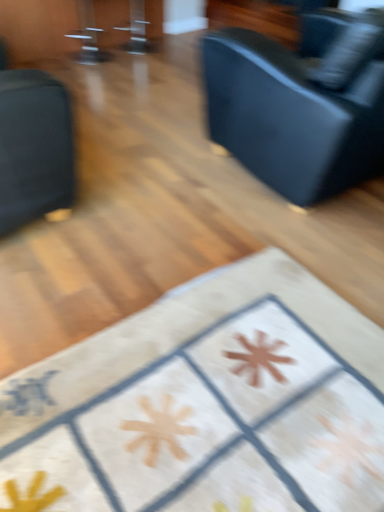
Question: Are white fabric rug at center, which ranks as the second furniture in top-to-bottom order, and black leather couch at upper right far apart?

Choices:
 (A) no
 (B) yes

Answer: (B)

Question: Is black leather couch at upper right a part of white fabric rug at center, the first furniture in the right-to-left sequence?

Choices:
 (A) no
 (B) yes

Answer: (A)

Question: From a real-world perspective, does white fabric rug at center, which ranks as the 1th furniture in bottom-to-top order, stand above black leather couch at upper right?

Choices:
 (A) yes
 (B) no

Answer: (B)

Question: Is white fabric rug at center, the first furniture in the right-to-left sequence, completely or partially outside of black leather couch at upper right?

Choices:
 (A) no
 (B) yes

Answer: (B)

Question: Does white fabric rug at center, which ranks as the second furniture in top-to-bottom order, have a larger size compared to black leather couch at upper right?

Choices:
 (A) no
 (B) yes

Answer: (A)

Question: From the image's perspective, is matte black couch at left, the second furniture when ordered from bottom to top, positioned above or below black leather couch at upper right?

Choices:
 (A) below
 (B) above

Answer: (A)

Question: In terms of size, does matte black couch at left, the second furniture in the right-to-left sequence, appear bigger or smaller than black leather couch at upper right?

Choices:
 (A) small
 (B) big

Answer: (A)

Question: In terms of height, does matte black couch at left, the second furniture in the right-to-left sequence, look taller or shorter compared to black leather couch at upper right?

Choices:
 (A) tall
 (B) short

Answer: (B)

Question: Is matte black couch at left, placed as the first furniture when sorted from top to bottom, inside or outside of black leather couch at upper right?

Choices:
 (A) outside
 (B) inside

Answer: (A)

Question: Is black leather couch at upper right to the left or to the right of matte black couch at left, the second furniture when ordered from bottom to top, in the image?

Choices:
 (A) left
 (B) right

Answer: (B)

Question: Relative to matte black couch at left, the second furniture in the right-to-left sequence, is black leather couch at upper right in front or behind?

Choices:
 (A) behind
 (B) front

Answer: (A)

Question: In terms of height, does black leather couch at upper right look taller or shorter compared to matte black couch at left, placed as the first furniture when sorted from top to bottom?

Choices:
 (A) short
 (B) tall

Answer: (B)

Question: Is black leather couch at upper right bigger or smaller than matte black couch at left, placed as the first furniture when sorted from top to bottom?

Choices:
 (A) big
 (B) small

Answer: (A)

Question: Would you say white fabric rug at center, which ranks as the second furniture in top-to-bottom order, is inside or outside black leather couch at upper right?

Choices:
 (A) inside
 (B) outside

Answer: (B)

Question: From their relative heights in the image, would you say white fabric rug at center, which ranks as the 1th furniture in bottom-to-top order, is taller or shorter than black leather couch at upper right?

Choices:
 (A) tall
 (B) short

Answer: (B)